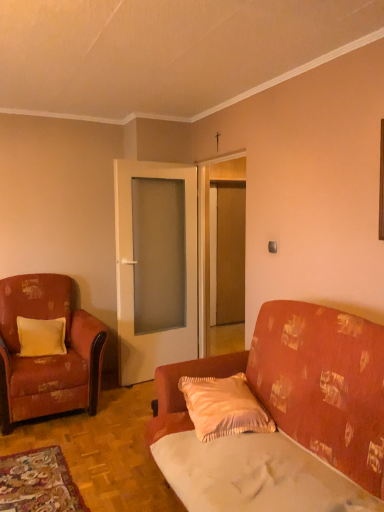
Identify the location of unoccupied area in front of distressed fabric armchair at left. The image size is (384, 512). (60, 456).